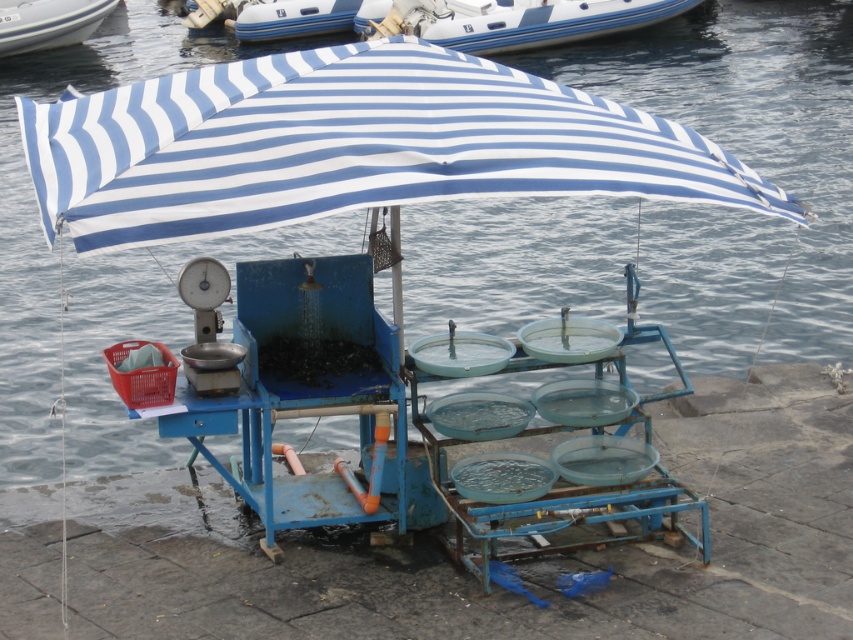
You are a customer at the stall and want to choose a boat to rent. The stall has a blue rubber boat at upper center and a white glossy boat at upper left. Which boat is wider?

The blue rubber boat at upper center is wider than the white glossy boat at upper left according to the description.

You are a customer at the stall and want to choose a boat to rent. The blue rubber boat at upper center and the white glossy boat at upper left are available. Which boat is shorter in height?

The blue rubber boat at upper center has a lesser height compared to the white glossy boat at upper left, so the blue rubber boat at upper center is shorter in height.

You are standing at the center of the table and want to place an item at the exact center of the table. The blue rubber boat at upper center is currently at point 0.033, 0.599. Where should you place the item to be exactly at the center of the table?

The blue rubber boat at upper center is at point (509, 20), so the exact center of the table would be at point (426, 320). Therefore, you should place the item at (426, 320) to be exactly at the center of the table.